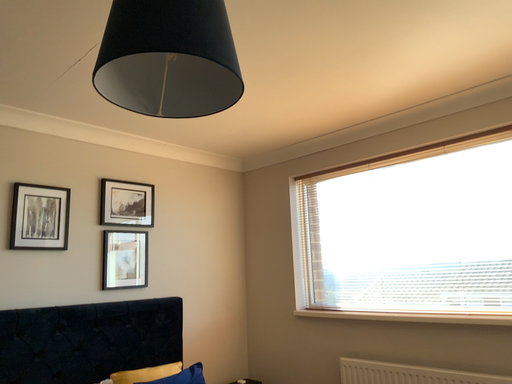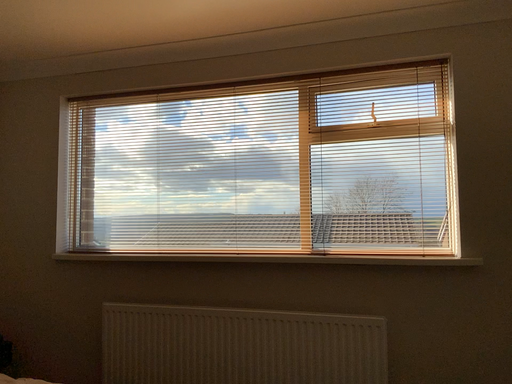
Question: Which way did the camera rotate in the video?

Choices:
 (A) rotated upward
 (B) rotated downward

Answer: (B)